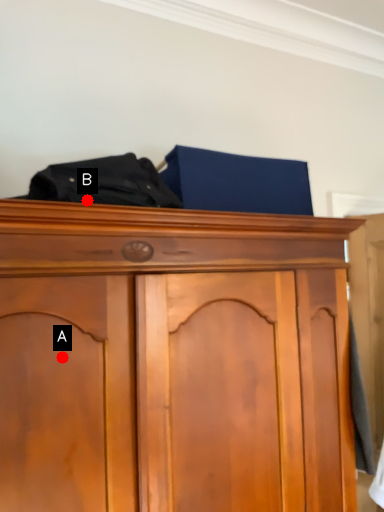
Question: Two points are circled on the image, labeled by A and B beside each circle. Among these points, which one is farthest from the camera?

Choices:
 (A) A is further
 (B) B is further

Answer: (B)